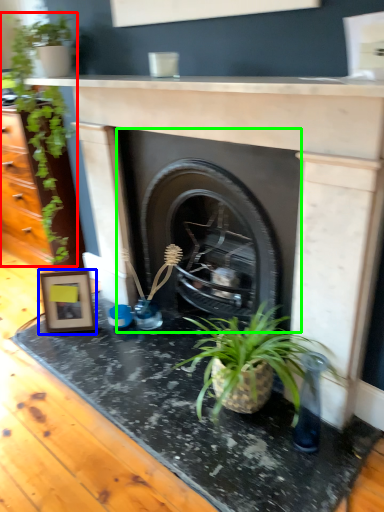
Question: Which is farther away from houseplant (highlighted by a red box)? picture frame (highlighted by a blue box) or fireplace (highlighted by a green box)?

Choices:
 (A) picture frame
 (B) fireplace

Answer: (B)